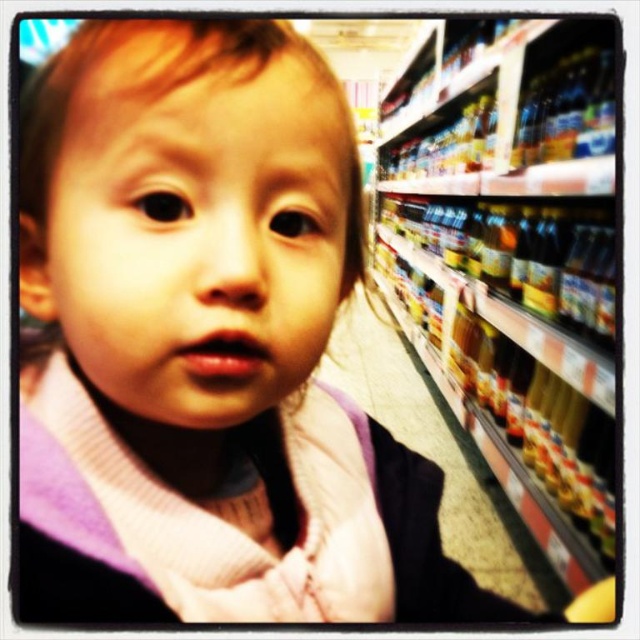
Does point (576, 92) lie behind point (387, 392)?

No, (576, 92) is closer to viewer.

Is metallic glass bottles at right behind translucent plastic bottles at right?

No, metallic glass bottles at right is in front of translucent plastic bottles at right.

Which is in front, point (529, 182) or point (499, 566)?

Point (529, 182) is more forward.

Where is `metallic glass bottles at right`? The image size is (640, 640). metallic glass bottles at right is located at coordinates (513, 259).